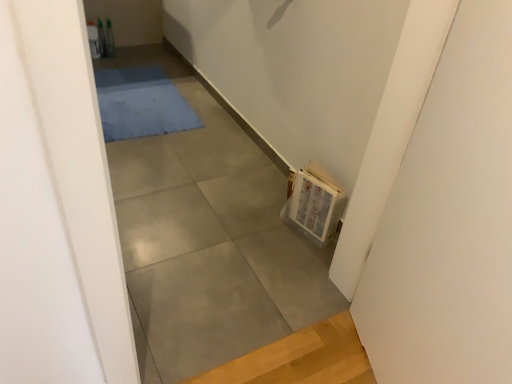
Question: Considering the relative positions of wooden frame at right and blue soft rug at upper center in the image provided, is wooden frame at right in front of blue soft rug at upper center?

Choices:
 (A) no
 (B) yes

Answer: (B)

Question: Is wooden frame at right outside of blue soft rug at upper center?

Choices:
 (A) yes
 (B) no

Answer: (A)

Question: From the image's perspective, is wooden frame at right below blue soft rug at upper center?

Choices:
 (A) no
 (B) yes

Answer: (B)

Question: Is wooden frame at right facing towards blue soft rug at upper center?

Choices:
 (A) no
 (B) yes

Answer: (A)

Question: Can you confirm if wooden frame at right is wider than blue soft rug at upper center?

Choices:
 (A) yes
 (B) no

Answer: (B)

Question: From a real-world perspective, is wooden frame at right physically above blue soft rug at upper center?

Choices:
 (A) no
 (B) yes

Answer: (B)

Question: From the image's perspective, is gray concrete at center above wooden frame at right?

Choices:
 (A) no
 (B) yes

Answer: (B)

Question: Considering the relative sizes of gray concrete at center and wooden frame at right in the image provided, is gray concrete at center shorter than wooden frame at right?

Choices:
 (A) yes
 (B) no

Answer: (A)

Question: Is gray concrete at center at the left side of wooden frame at right?

Choices:
 (A) yes
 (B) no

Answer: (A)

Question: Can you confirm if gray concrete at center is wider than wooden frame at right?

Choices:
 (A) no
 (B) yes

Answer: (B)

Question: Does gray concrete at center have a greater height compared to wooden frame at right?

Choices:
 (A) no
 (B) yes

Answer: (A)

Question: Could wooden frame at right be considered to be inside gray concrete at center?

Choices:
 (A) no
 (B) yes

Answer: (A)

Question: Is gray concrete at center bigger than blue soft rug at upper center?

Choices:
 (A) yes
 (B) no

Answer: (A)